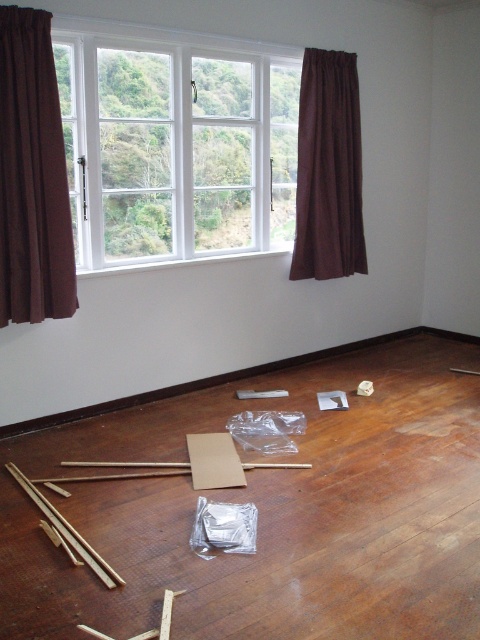
Does brown wood floor at center have a smaller size compared to white glass window at upper center?

Incorrect, brown wood floor at center is not smaller in size than white glass window at upper center.

What are the coordinates of `brown wood floor at center` in the screenshot? It's located at (271, 513).

Who is lower down, white glass window at upper center or brown velvet curtain at left?

brown velvet curtain at left is lower down.

Is point (78, 148) positioned in front of point (36, 296)?

No, it is not.

Where is `white glass window at upper center`? white glass window at upper center is located at coordinates (176, 145).

This screenshot has height=640, width=480. In order to click on white glass window at upper center in this screenshot , I will do `click(176, 145)`.

Can you confirm if brown wood floor at center is smaller than brown fabric curtain at right?

No.

Does brown wood floor at center have a lesser height compared to brown fabric curtain at right?

Correct, brown wood floor at center is not as tall as brown fabric curtain at right.

Identify the location of brown wood floor at center. (271, 513).

Identify the location of brown wood floor at center. (271, 513).